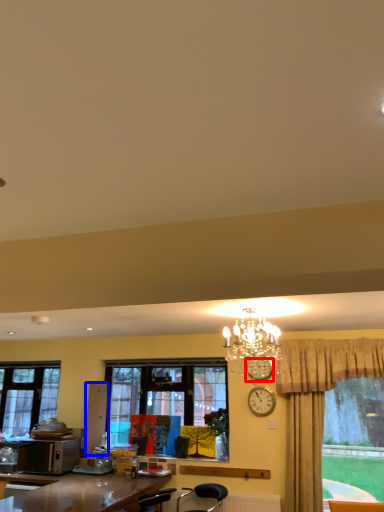
Question: Which object is closer to the camera taking this photo, clock (highlighted by a red box) or cabinetry (highlighted by a blue box)?

Choices:
 (A) clock
 (B) cabinetry

Answer: (A)